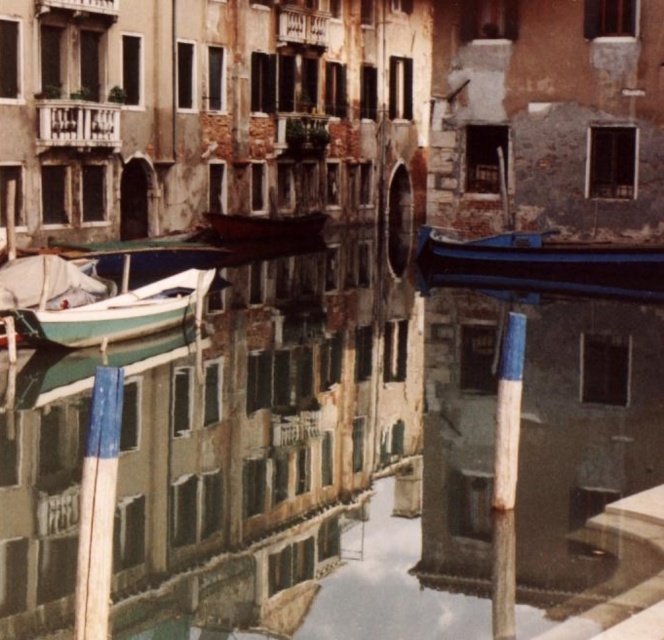
Question: Which object is closer to the camera taking this photo?

Choices:
 (A) green matte boat at left
 (B) smooth concrete canal at center
 (C) wooden boat at center
 (D) blue glossy boat at right

Answer: (B)

Question: Is smooth concrete canal at center below wooden boat at center?

Choices:
 (A) no
 (B) yes

Answer: (B)

Question: Which of the following is the closest to the observer?

Choices:
 (A) green matte boat at left
 (B) smooth concrete canal at center
 (C) blue glossy boat at right
 (D) wooden boat at center

Answer: (B)

Question: Is blue glossy boat at right positioned in front of wooden boat at center?

Choices:
 (A) no
 (B) yes

Answer: (B)

Question: Which point is farther from the camera taking this photo?

Choices:
 (A) (29, 500)
 (B) (153, 285)
 (C) (305, 216)
 (D) (505, 269)

Answer: (C)

Question: Does smooth concrete canal at center have a greater width compared to green matte boat at left?

Choices:
 (A) no
 (B) yes

Answer: (B)